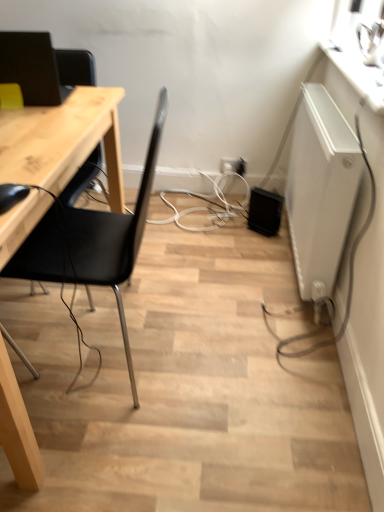
Locate an element on the screen. The width and height of the screenshot is (384, 512). free space behind black matte chair at left is located at coordinates (179, 256).